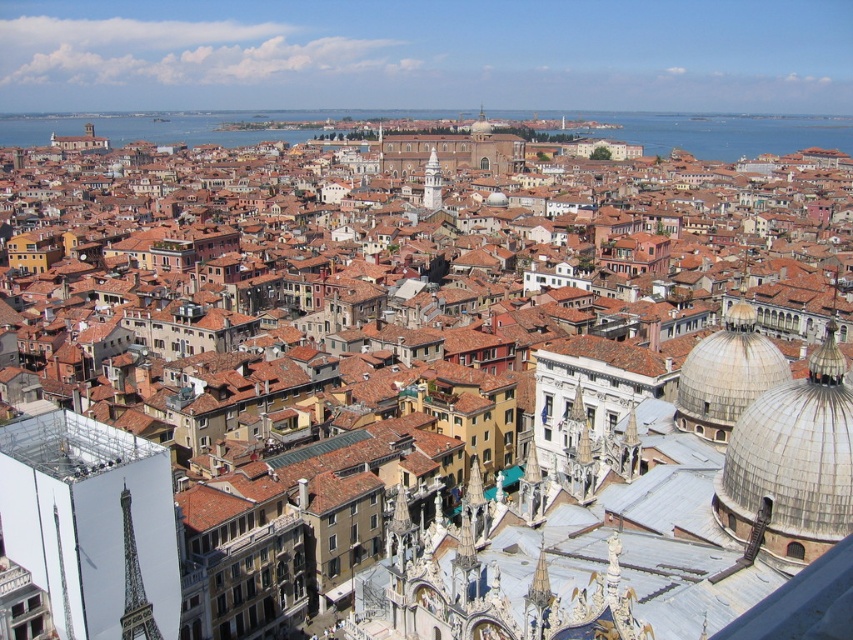
Question: Does white reflective tower at center come behind white marble tower at center?

Choices:
 (A) no
 (B) yes

Answer: (A)

Question: Which is farther from the white marble tower at center?

Choices:
 (A) white reflective tower at center
 (B) blue water at center

Answer: (A)

Question: Can you confirm if shiny silver tower at lower left is smaller than white marble tower at center?

Choices:
 (A) yes
 (B) no

Answer: (A)

Question: Which point is farther to the camera?

Choices:
 (A) white marble tower at center
 (B) white reflective tower at center
 (C) smooth white dome at upper right
 (D) blue water at center

Answer: (D)

Question: Does white reflective tower at center have a smaller size compared to white marble tower at center?

Choices:
 (A) no
 (B) yes

Answer: (B)

Question: Among these points, which one is farthest from the camera?

Choices:
 (A) (764, 346)
 (B) (131, 593)

Answer: (A)